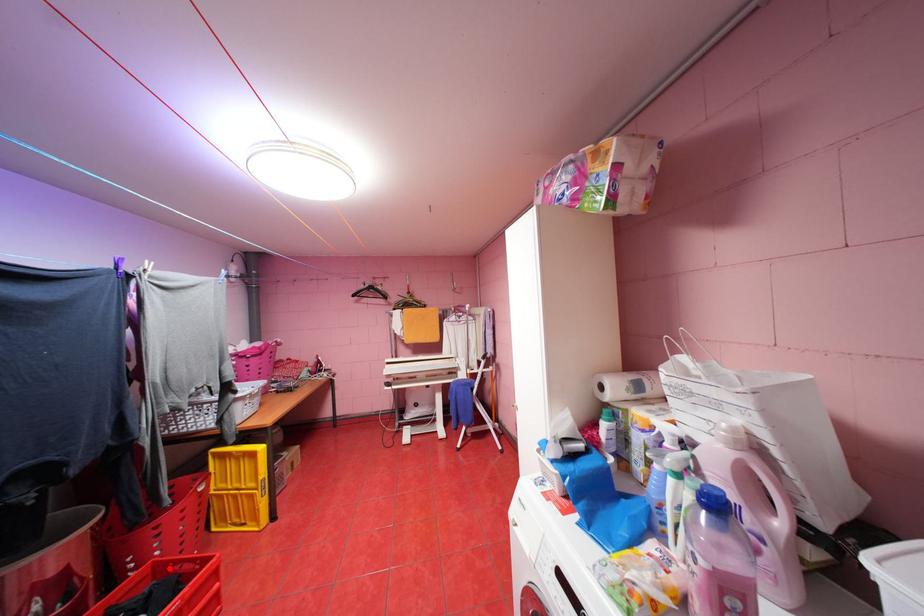
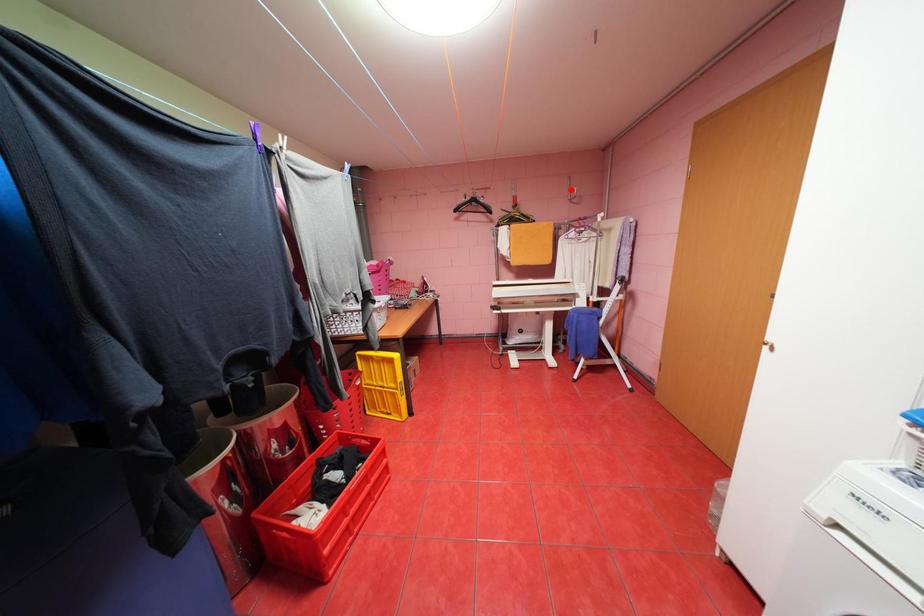
Looking at this image, I am providing you with two images of the same scene from different viewpoints. A red point is marked on the first image and another point is marked on the second image. Is the marked point in image1 the same physical position as the marked point in image2?

No